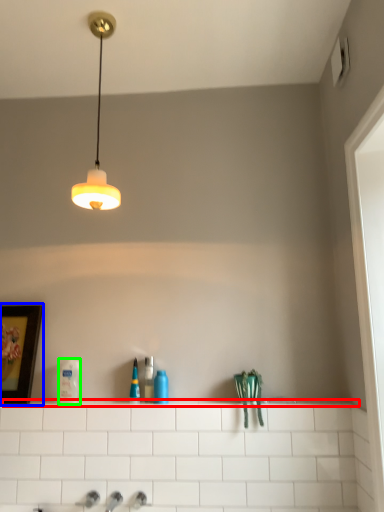
Question: Which object is the farthest from ledge (highlighted by a red box)? Choose among these: picture frame (highlighted by a blue box) or toiletry (highlighted by a green box).

Choices:
 (A) picture frame
 (B) toiletry

Answer: (A)